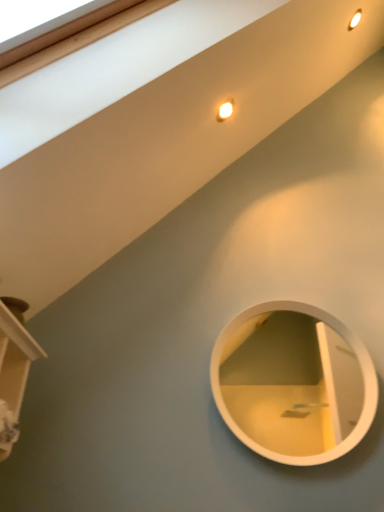
Question: Considering the positions of point (29, 348) and point (359, 394), is point (29, 348) closer or farther from the camera than point (359, 394)?

Choices:
 (A) farther
 (B) closer

Answer: (B)

Question: In the image, is wooden shelf at lower left on the left side or the right side of white glossy mirror at center?

Choices:
 (A) left
 (B) right

Answer: (A)

Question: Considering the positions of wooden shelf at lower left and white glossy mirror at center in the image, is wooden shelf at lower left wider or thinner than white glossy mirror at center?

Choices:
 (A) thin
 (B) wide

Answer: (B)

Question: From the image's perspective, is white glossy mirror at center located above or below wooden shelf at lower left?

Choices:
 (A) below
 (B) above

Answer: (A)

Question: From their relative heights in the image, would you say white glossy mirror at center is taller or shorter than wooden shelf at lower left?

Choices:
 (A) short
 (B) tall

Answer: (B)

Question: Based on their positions, is white glossy mirror at center located to the left or right of wooden shelf at lower left?

Choices:
 (A) right
 (B) left

Answer: (A)

Question: Is white glossy mirror at center wider or thinner than wooden shelf at lower left?

Choices:
 (A) thin
 (B) wide

Answer: (A)